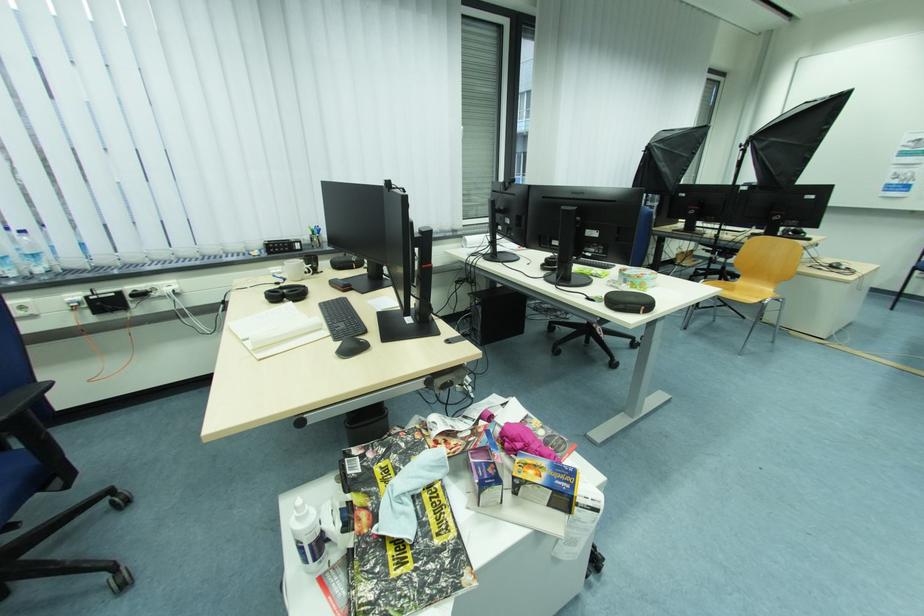
You are a GUI agent. You are given a task and a screenshot of the screen. Output one action in this format:
    pyautogui.click(x=<x>, y=<y>)
    Task: Click on the wooden chair sitting surface
    
    Given the screenshot: What is the action you would take?
    pyautogui.click(x=743, y=291)